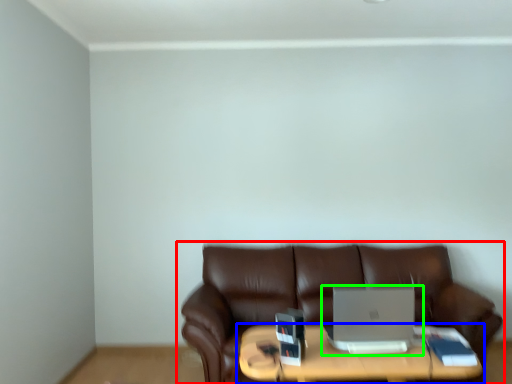
Question: Estimate the real-world distances between objects in this image. Which object is farther from studio couch (highlighted by a red box), table (highlighted by a blue box) or laptop (highlighted by a green box)?

Choices:
 (A) table
 (B) laptop

Answer: (B)